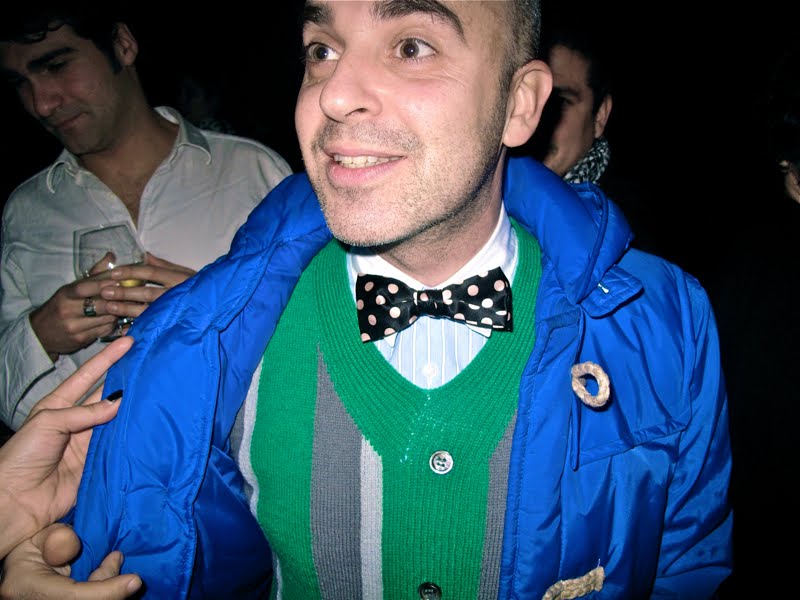
Identify the location of glass. (102, 244).